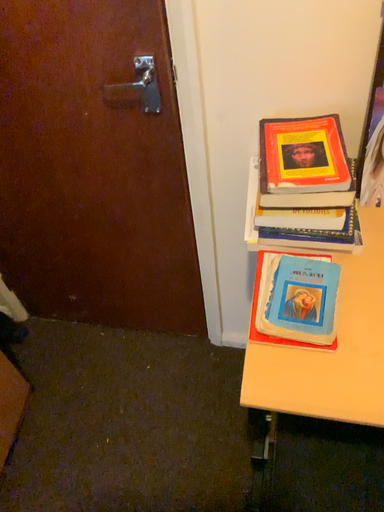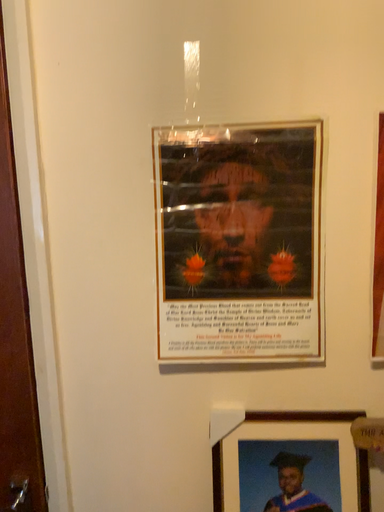
Question: Which way did the camera rotate in the video?

Choices:
 (A) rotated right
 (B) rotated left

Answer: (A)